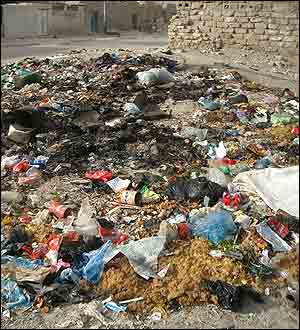
Locate an element on the screen. This screenshot has height=330, width=300. door is located at coordinates (136, 22).